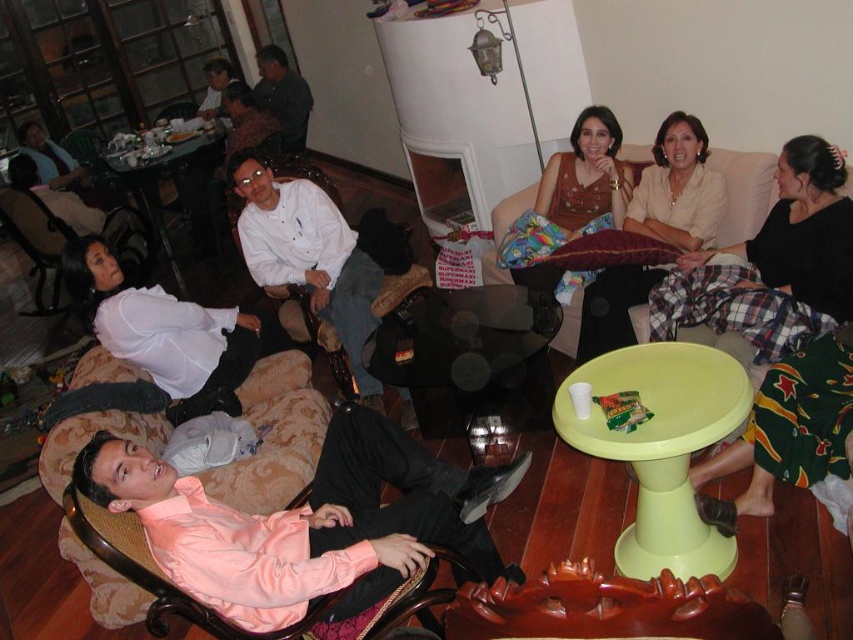
Question: Among these points, which one is nearest to the camera?

Choices:
 (A) (358, 369)
 (B) (721, 328)

Answer: (B)

Question: Is the position of velvet-like beige couch at lower left more distant than that of light beige fabric couch at upper right?

Choices:
 (A) no
 (B) yes

Answer: (A)

Question: Among these points, which one is nearest to the camera?

Choices:
 (A) (817, 285)
 (B) (598, 276)

Answer: (A)

Question: Is white satin blouse at lower left above brown satin dress at center?

Choices:
 (A) yes
 (B) no

Answer: (B)

Question: Among these points, which one is farthest from the camera?

Choices:
 (A) (355, 275)
 (B) (695, 218)
 (C) (735, 204)
 (D) (218, 492)

Answer: (A)

Question: Does white satin blouse at lower left have a greater width compared to matte beige blouse at center?

Choices:
 (A) no
 (B) yes

Answer: (B)